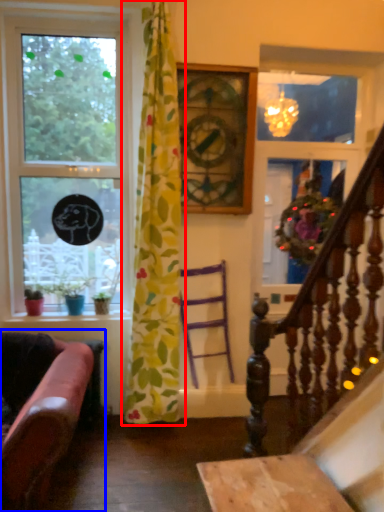
Question: Which point is further to the camera, curtain (highlighted by a red box) or studio couch (highlighted by a blue box)?

Choices:
 (A) curtain
 (B) studio couch

Answer: (A)